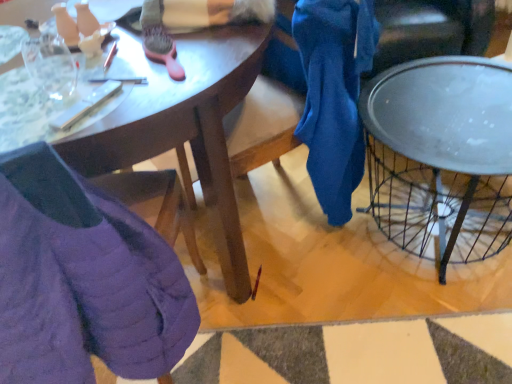
In order to click on metallic silver tray at right in this screenshot , I will do `click(441, 157)`.

I want to click on metallic silver tray at right, so click(x=441, y=157).

Based on their sizes in the image, would you say metallic silver tray at right is bigger or smaller than matte wooden desk at center?

Considering their sizes, metallic silver tray at right takes up less space than matte wooden desk at center.

Is metallic silver tray at right located outside matte wooden desk at center?

Indeed, metallic silver tray at right is completely outside matte wooden desk at center.

Is metallic silver tray at right shorter than matte wooden desk at center?

Correct, metallic silver tray at right is not as tall as matte wooden desk at center.

Looking at their sizes, would you say purple quilted jacket at lower left is wider or thinner than matte wooden desk at center?

Considering their sizes, purple quilted jacket at lower left looks slimmer than matte wooden desk at center.

Which is behind, point (27, 331) or point (208, 178)?

The point (208, 178) is farther from the camera.

Between purple quilted jacket at lower left and matte wooden desk at center, which one has smaller size?

purple quilted jacket at lower left is smaller.

In the scene shown: Is purple quilted jacket at lower left turned away from matte wooden desk at center?

No.

Considering the sizes of objects purple quilted jacket at lower left and metallic silver tray at right in the image provided, who is thinner, purple quilted jacket at lower left or metallic silver tray at right?

purple quilted jacket at lower left is thinner.

Is purple quilted jacket at lower left directly adjacent to metallic silver tray at right?

No, purple quilted jacket at lower left is not touching metallic silver tray at right.

Is purple quilted jacket at lower left shorter than metallic silver tray at right?

No, purple quilted jacket at lower left is not shorter than metallic silver tray at right.

Which object is further away from the camera, purple quilted jacket at lower left or metallic silver tray at right?

metallic silver tray at right is further away from the camera.

The height and width of the screenshot is (384, 512). In order to click on coffee table above the purple quilted jacket at lower left (from the image's perspective) in this screenshot , I will do `click(441, 157)`.

Does metallic silver tray at right have a lesser height compared to purple quilted jacket at lower left?

Indeed, metallic silver tray at right has a lesser height compared to purple quilted jacket at lower left.

Would you consider metallic silver tray at right to be distant from purple quilted jacket at lower left?

They are positioned close to each other.

Considering the sizes of objects metallic silver tray at right and purple quilted jacket at lower left in the image provided, who is bigger, metallic silver tray at right or purple quilted jacket at lower left?

Bigger between the two is metallic silver tray at right.

Where is `desk above the metallic silver tray at right (from the image's perspective)`? This screenshot has width=512, height=384. desk above the metallic silver tray at right (from the image's perspective) is located at coordinates (183, 126).

In the scene shown: Considering the relative positions of matte wooden desk at center and metallic silver tray at right in the image provided, is matte wooden desk at center to the right of metallic silver tray at right from the viewer's perspective?

No, matte wooden desk at center is not to the right of metallic silver tray at right.

Looking at this image, considering the relative sizes of matte wooden desk at center and metallic silver tray at right in the image provided, is matte wooden desk at center bigger than metallic silver tray at right?

Yes, matte wooden desk at center is bigger than metallic silver tray at right.

Can you tell me how much matte wooden desk at center and metallic silver tray at right differ in facing direction?

3.45 degrees separate the facing orientations of matte wooden desk at center and metallic silver tray at right.

Is matte wooden desk at center bigger or smaller than purple quilted jacket at lower left?

Considering their sizes, matte wooden desk at center takes up more space than purple quilted jacket at lower left.

Find the location of `desk above the purple quilted jacket at lower left (from the image's perspective)`. desk above the purple quilted jacket at lower left (from the image's perspective) is located at coordinates (183, 126).

Is point (137, 50) farther from camera compared to point (127, 281)?

That is True.

Looking at this image, from a real-world perspective, which object rests below the other?

From a 3D spatial view, matte wooden desk at center is below.

In the image, there is a matte wooden desk at center. Where is `coffee table below it (from a real-world perspective)`? This screenshot has height=384, width=512. coffee table below it (from a real-world perspective) is located at coordinates (441, 157).

Where is `desk behind the purple quilted jacket at lower left`? This screenshot has width=512, height=384. desk behind the purple quilted jacket at lower left is located at coordinates (183, 126).

Considering their positions, is purple quilted jacket at lower left positioned closer to metallic silver tray at right than matte wooden desk at center?

Among the two, matte wooden desk at center is located nearer to metallic silver tray at right.

When comparing their distances from metallic silver tray at right, does matte wooden desk at center or purple quilted jacket at lower left seem closer?

matte wooden desk at center is positioned closer to the anchor metallic silver tray at right.

Based on their spatial positions, is matte wooden desk at center or metallic silver tray at right closer to purple quilted jacket at lower left?

The object closer to purple quilted jacket at lower left is matte wooden desk at center.

Which object lies nearer to the anchor point purple quilted jacket at lower left, metallic silver tray at right or matte wooden desk at center?

matte wooden desk at center is closer to purple quilted jacket at lower left.

Looking at this image, considering their positions, is metallic silver tray at right positioned closer to matte wooden desk at center than purple quilted jacket at lower left?

purple quilted jacket at lower left lies closer to matte wooden desk at center than the other object.

In the scene shown: Estimate the real-world distances between objects in this image. Which object is further from matte wooden desk at center, purple quilted jacket at lower left or metallic silver tray at right?

metallic silver tray at right is further to matte wooden desk at center.

The image size is (512, 384). I want to click on desk between purple quilted jacket at lower left and metallic silver tray at right, so click(x=183, y=126).